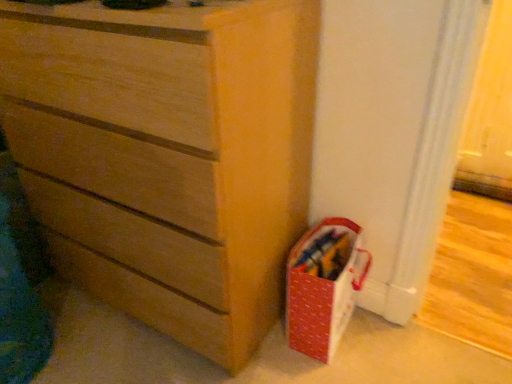
What are the coordinates of `matte wood chest of drawers at center` in the screenshot? It's located at (168, 155).

Measure the distance between point (27, 106) and camera.

Point (27, 106) is 1.16 meters away from camera.

Describe the element at coordinates (168, 155) in the screenshot. I see `matte wood chest of drawers at center` at that location.

In order to face matte wood chest of drawers at center, should I rotate leftwards or rightwards?

It's best to rotate left around 12.215 degrees.

You are a GUI agent. You are given a task and a screenshot of the screen. Output one action in this format:
    pyautogui.click(x=<x>, y=<y>)
    Task: Click on the red fabric basket at lower right
    Image resolution: width=512 pixels, height=384 pixels.
    Given the screenshot: What is the action you would take?
    pyautogui.click(x=324, y=286)

What do you see at coordinates (324, 286) in the screenshot?
I see `red fabric basket at lower right` at bounding box center [324, 286].

Where is `matte wood chest of drawers at center`? This screenshot has width=512, height=384. matte wood chest of drawers at center is located at coordinates (168, 155).

Which object is positioned more to the left, red fabric basket at lower right or matte wood chest of drawers at center?

matte wood chest of drawers at center is more to the left.

Which object is closer to the camera, red fabric basket at lower right or matte wood chest of drawers at center?

matte wood chest of drawers at center.

Which is behind, point (306, 267) or point (58, 51)?

The point (306, 267) is farther from the camera.

Based on the photo, from the image's perspective, is red fabric basket at lower right located above matte wood chest of drawers at center?

No, from the image's perspective, red fabric basket at lower right is not on top of matte wood chest of drawers at center.

From a real-world perspective, between red fabric basket at lower right and matte wood chest of drawers at center, who is vertically lower?

In real-world perspective, red fabric basket at lower right is lower.

Which of these two, red fabric basket at lower right or matte wood chest of drawers at center, is thinner?

Thinner between the two is red fabric basket at lower right.

Consider the image. Which of these two, red fabric basket at lower right or matte wood chest of drawers at center, stands taller?

With more height is matte wood chest of drawers at center.

Which of these two, red fabric basket at lower right or matte wood chest of drawers at center, is smaller?

red fabric basket at lower right.

Is red fabric basket at lower right inside or outside of matte wood chest of drawers at center?

red fabric basket at lower right is not inside matte wood chest of drawers at center, it's outside.

Is red fabric basket at lower right positioned far away from matte wood chest of drawers at center?

No, red fabric basket at lower right is not far from matte wood chest of drawers at center.

Based on the photo, is red fabric basket at lower right facing away from matte wood chest of drawers at center?

That's not correct — red fabric basket at lower right is not looking away from matte wood chest of drawers at center.

How different are the orientations of red fabric basket at lower right and matte wood chest of drawers at center in degrees?

They differ by 3.98 degrees in their facing directions.

Where is `chest of drawers above the red fabric basket at lower right (from the image's perspective)`? The image size is (512, 384). chest of drawers above the red fabric basket at lower right (from the image's perspective) is located at coordinates (168, 155).

Between matte wood chest of drawers at center and red fabric basket at lower right, which one appears on the right side from the viewer's perspective?

From the viewer's perspective, red fabric basket at lower right appears more on the right side.

Which is behind, matte wood chest of drawers at center or red fabric basket at lower right?

red fabric basket at lower right is behind.

Which is more distant, [248,38] or [335,232]?

The point [335,232] is behind.

From the image's perspective, is matte wood chest of drawers at center located beneath red fabric basket at lower right?

No, from the image's perspective, matte wood chest of drawers at center is not below red fabric basket at lower right.

From a real-world perspective, which object stands above the other?

matte wood chest of drawers at center, from a real-world perspective.

Can you confirm if matte wood chest of drawers at center is thinner than red fabric basket at lower right?

No.

Considering the sizes of matte wood chest of drawers at center and red fabric basket at lower right in the image, is matte wood chest of drawers at center taller or shorter than red fabric basket at lower right?

Considering their sizes, matte wood chest of drawers at center has more height than red fabric basket at lower right.

Considering the sizes of objects matte wood chest of drawers at center and red fabric basket at lower right in the image provided, who is smaller, matte wood chest of drawers at center or red fabric basket at lower right?

red fabric basket at lower right is smaller.

Would you say matte wood chest of drawers at center is inside or outside red fabric basket at lower right?

matte wood chest of drawers at center is not inside red fabric basket at lower right, it's outside.

Based on the photo, are matte wood chest of drawers at center and red fabric basket at lower right making contact?

No, matte wood chest of drawers at center is not beside red fabric basket at lower right.

Is matte wood chest of drawers at center positioned with its back to red fabric basket at lower right?

No, red fabric basket at lower right is not at the back of matte wood chest of drawers at center.

This screenshot has width=512, height=384. I want to click on chest of drawers in front of the red fabric basket at lower right, so click(168, 155).

Identify the location of chest of drawers in front of the red fabric basket at lower right. This screenshot has height=384, width=512. (168, 155).

Where is `kit behind the matte wood chest of drawers at center`? The image size is (512, 384). kit behind the matte wood chest of drawers at center is located at coordinates (324, 286).